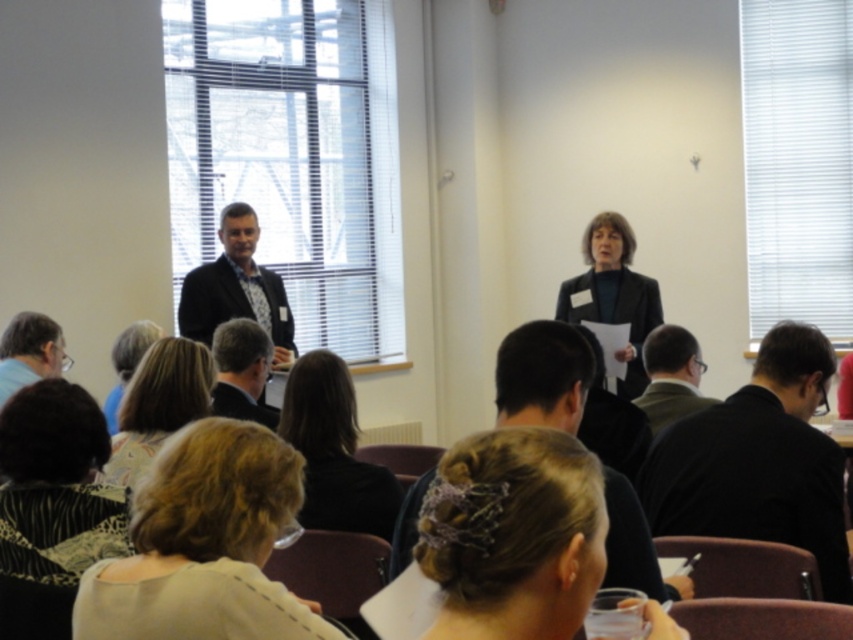
The width and height of the screenshot is (853, 640). I want to click on zebra print scarf at lower left, so click(55, 486).

Can you confirm if zebra print scarf at lower left is positioned below blonde hair at center?

Incorrect, zebra print scarf at lower left is not positioned below blonde hair at center.

Does point (78, 452) come closer to viewer compared to point (144, 330)?

Yes, it is.

What are the coordinates of `zebra print scarf at lower left` in the screenshot? It's located at (55, 486).

Who is higher up, dark brown hair at center or light brown hair at lower left?

light brown hair at lower left

Can you confirm if dark brown hair at center is shorter than light brown hair at lower left?

In fact, dark brown hair at center may be taller than light brown hair at lower left.

Does point (338, 433) come closer to viewer compared to point (123, 400)?

That is True.

Where is `dark brown hair at center`? dark brown hair at center is located at coordinates (334, 451).

Measure the distance from black matte jacket at lower right to dark brown hair at center.

black matte jacket at lower right is 1.05 meters from dark brown hair at center.

Which of these two, black matte jacket at lower right or dark brown hair at center, stands shorter?

With less height is dark brown hair at center.

Find the location of `black matte jacket at lower right`. black matte jacket at lower right is located at coordinates (759, 461).

Identify the location of black matte jacket at lower right. Image resolution: width=853 pixels, height=640 pixels. (759, 461).